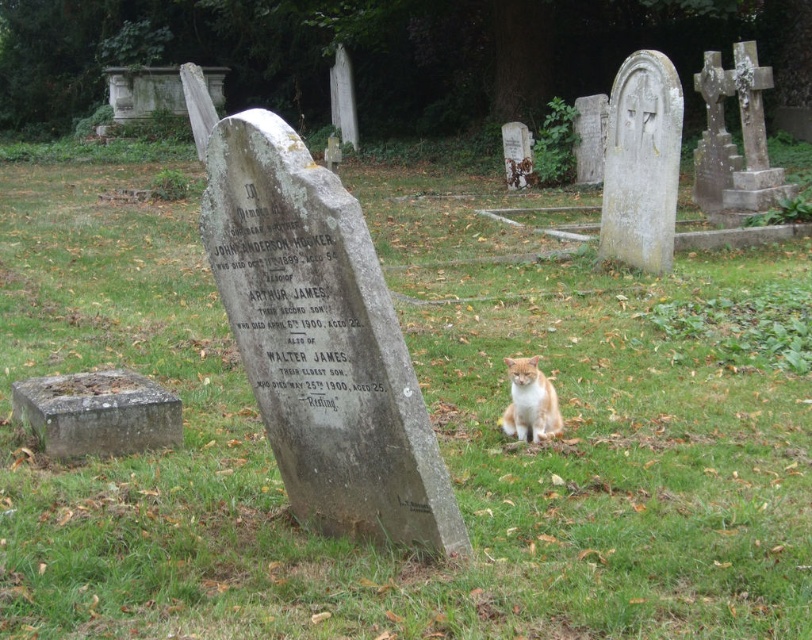
Who is positioned more to the right, gray stone at lower left or orange fur cat at center?

Positioned to the right is orange fur cat at center.

Who is higher up, gray stone at lower left or orange fur cat at center?

gray stone at lower left

At what (x,y) coordinates should I click in order to perform the action: click on gray stone at lower left. Please return your answer as a coordinate pair (x, y). Looking at the image, I should click on (97, 413).

This screenshot has height=640, width=812. In order to click on gray stone at lower left in this screenshot , I will do `click(97, 413)`.